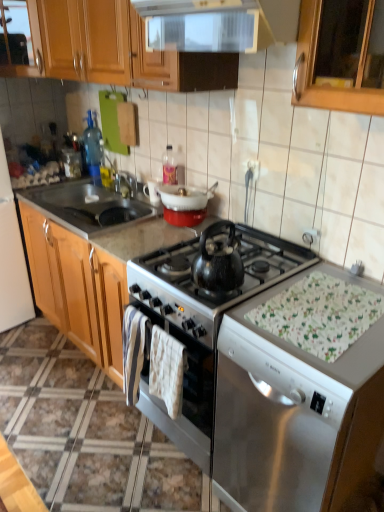
Question: Can we say white marble countertop at center lies outside metallic stainless steel sink at left, positioned as the 2th sink in right-to-left order?

Choices:
 (A) no
 (B) yes

Answer: (B)

Question: Is white marble countertop at center not close to metallic stainless steel sink at left, positioned as the 1th sink in left-to-right order?

Choices:
 (A) yes
 (B) no

Answer: (B)

Question: From a real-world perspective, is white marble countertop at center positioned over metallic stainless steel sink at left, positioned as the 1th sink in left-to-right order, based on gravity?

Choices:
 (A) yes
 (B) no

Answer: (B)

Question: From the image's perspective, is white marble countertop at center beneath metallic stainless steel sink at left, positioned as the 2th sink in right-to-left order?

Choices:
 (A) yes
 (B) no

Answer: (A)

Question: From the image's perspective, is white marble countertop at center located above metallic stainless steel sink at left, positioned as the 2th sink in right-to-left order?

Choices:
 (A) yes
 (B) no

Answer: (B)

Question: Is white marble countertop at center at the right side of metallic stainless steel sink at left, positioned as the 2th sink in right-to-left order?

Choices:
 (A) no
 (B) yes

Answer: (B)

Question: Is white marble countertop at center facing towards white glossy refrigerator at left, which appears as the 1th appliance when viewed from the left?

Choices:
 (A) no
 (B) yes

Answer: (A)

Question: From a real-world perspective, is white marble countertop at center over white glossy refrigerator at left, the 2th appliance viewed from the right?

Choices:
 (A) yes
 (B) no

Answer: (B)

Question: Considering the relative positions of white marble countertop at center and white glossy refrigerator at left, which appears as the 1th appliance when viewed from the left, in the image provided, is white marble countertop at center to the left of white glossy refrigerator at left, which appears as the 1th appliance when viewed from the left, from the viewer's perspective?

Choices:
 (A) no
 (B) yes

Answer: (A)

Question: Can you confirm if white marble countertop at center is taller than white glossy refrigerator at left, the 2th appliance viewed from the right?

Choices:
 (A) no
 (B) yes

Answer: (A)

Question: From the image's perspective, is white marble countertop at center over white glossy refrigerator at left, which appears as the 1th appliance when viewed from the left?

Choices:
 (A) yes
 (B) no

Answer: (B)

Question: From a real-world perspective, is white marble countertop at center physically below white glossy refrigerator at left, which appears as the 1th appliance when viewed from the left?

Choices:
 (A) yes
 (B) no

Answer: (A)

Question: Is white glossy refrigerator at left, the 2th appliance viewed from the right, not near wooden cabinet at upper left?

Choices:
 (A) no
 (B) yes

Answer: (A)